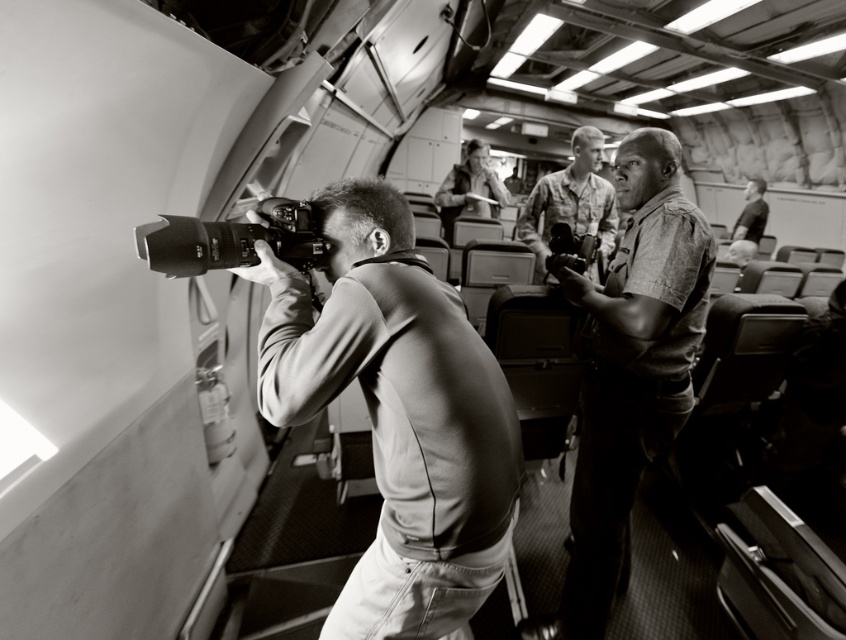
Between smooth leather jacket at center and camouflage uniform at center, which one appears on the right side from the viewer's perspective?

camouflage uniform at center is more to the right.

Between point (432, 529) and point (539, 280), which one is positioned behind?

The point (539, 280) is more distant.

Locate an element on the screen. smooth leather jacket at center is located at coordinates (397, 412).

Can you confirm if metallic silver camera at center is positioned to the left of metallic camera at center?

Yes, metallic silver camera at center is to the left of metallic camera at center.

Is metallic silver camera at center taller than metallic camera at center?

Incorrect, metallic silver camera at center's height is not larger of metallic camera at center's.

The height and width of the screenshot is (640, 846). Identify the location of metallic silver camera at center. (232, 241).

Does textured military uniform at center appear under camouflage uniform at center?

Yes.

Does textured military uniform at center appear on the right side of camouflage uniform at center?

Incorrect, textured military uniform at center is not on the right side of camouflage uniform at center.

Measure the distance between point (658,408) and camera.

Point (658,408) and camera are 1.61 meters apart.

The width and height of the screenshot is (846, 640). Find the location of `textured military uniform at center`. textured military uniform at center is located at coordinates (630, 369).